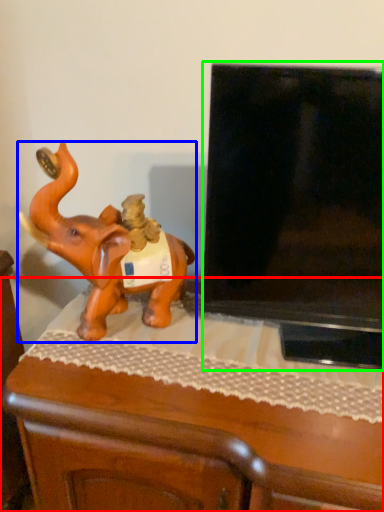
Question: Considering the real-world distances, which object is closest to furniture (highlighted by a red box)? elephant (highlighted by a blue box) or television (highlighted by a green box).

Choices:
 (A) elephant
 (B) television

Answer: (A)